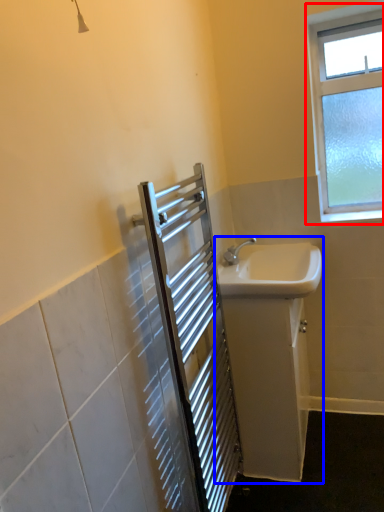
Question: Which of the following is the farthest to the observer, window (highlighted by a red box) or sink (highlighted by a blue box)?

Choices:
 (A) window
 (B) sink

Answer: (A)